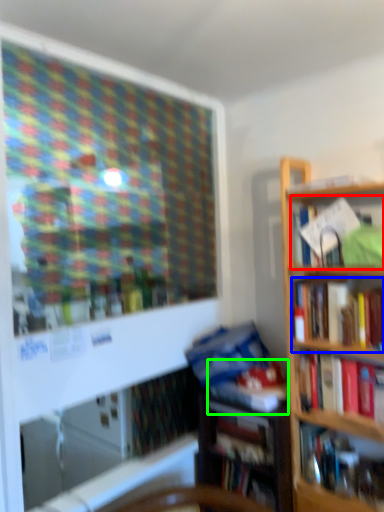
Question: Which is nearer to the book (highlighted by a red box)? book (highlighted by a blue box) or book (highlighted by a green box).

Choices:
 (A) book
 (B) book

Answer: (A)